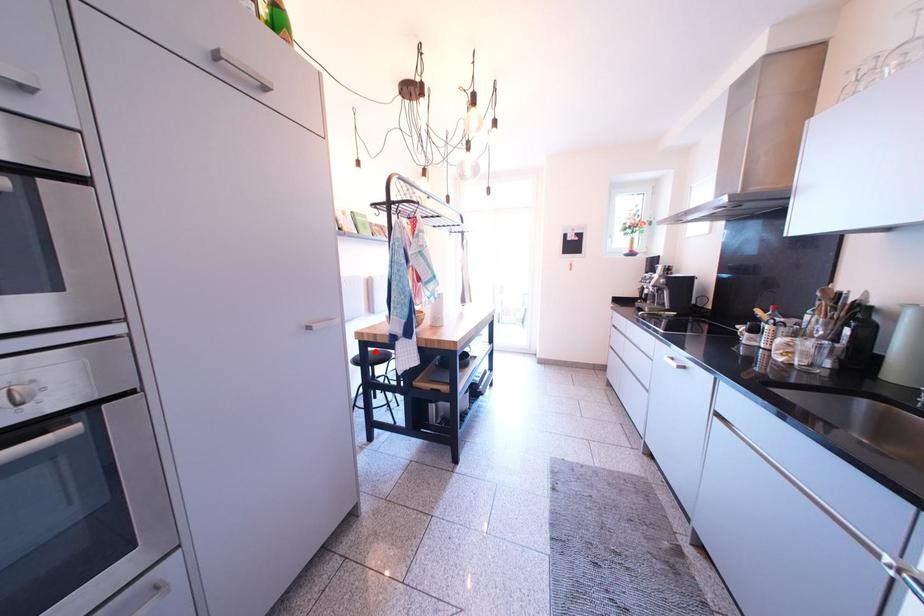
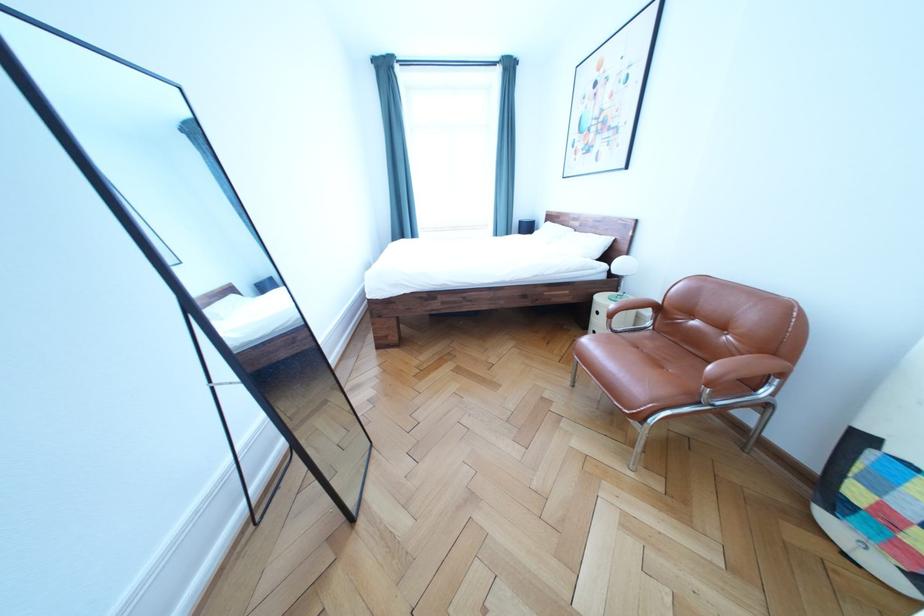
Question: I am providing you with two images of the same scene from different viewpoints. A red point is marked on the first image. Can you still see the location of the red point in image 2?

Choices:
 (A) Yes
 (B) No

Answer: (B)